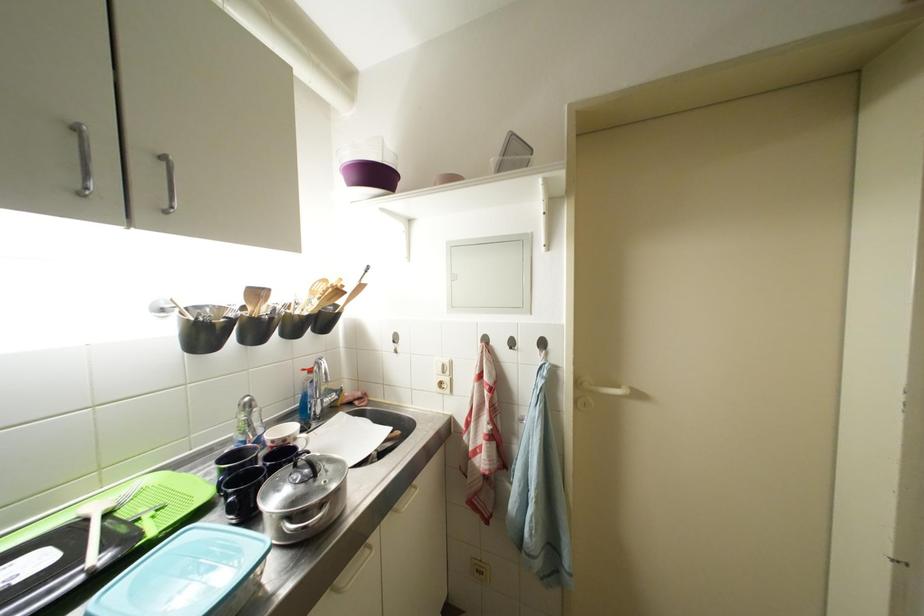
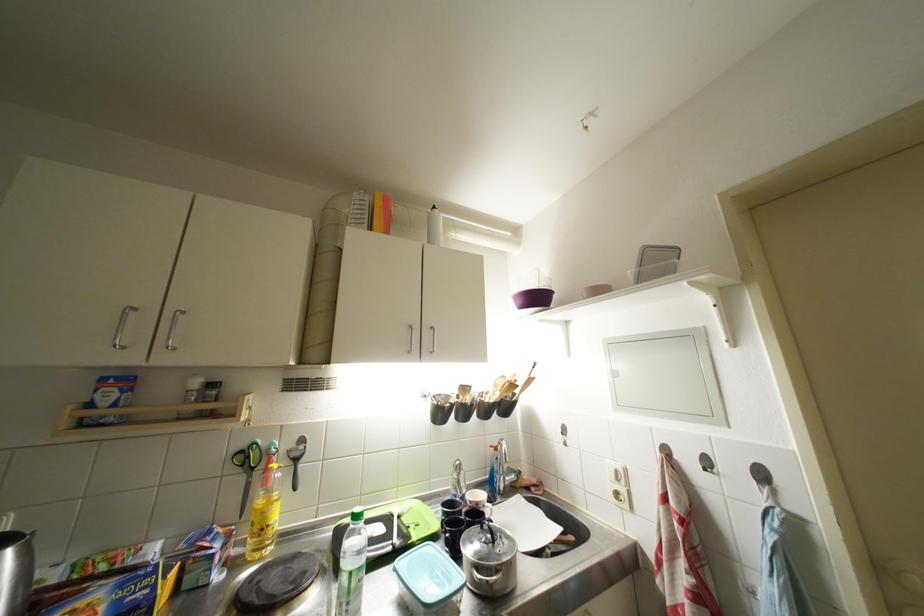
Find the pixel in the second image that matches point 518,347 in the first image.

(714, 467)